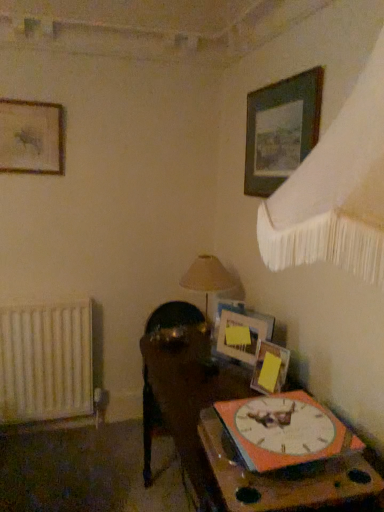
Locate an element on the screen. The width and height of the screenshot is (384, 512). free spot to the left of matte wooden picture frame at upper right, which ranks as the 3th picture frame in right-to-left order is located at coordinates (210, 365).